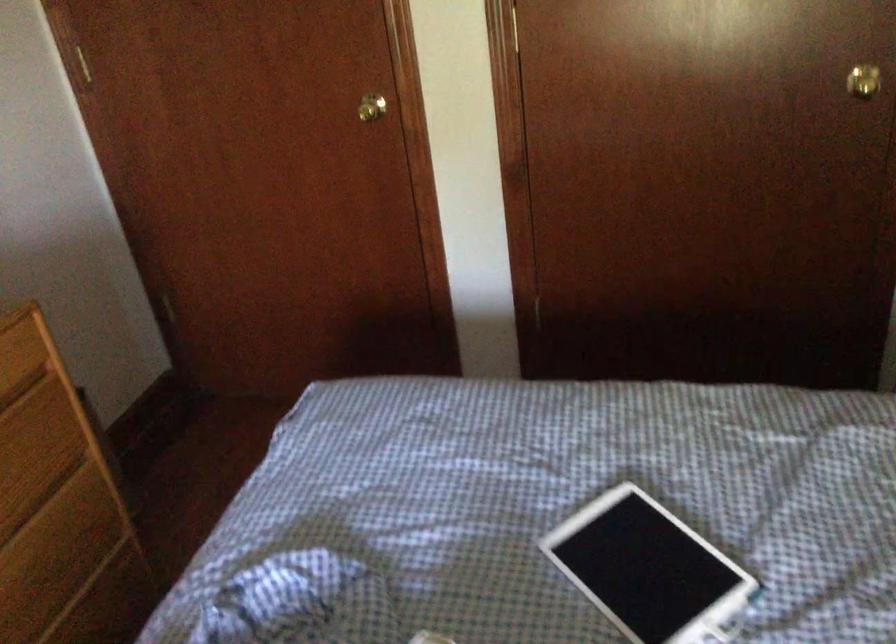
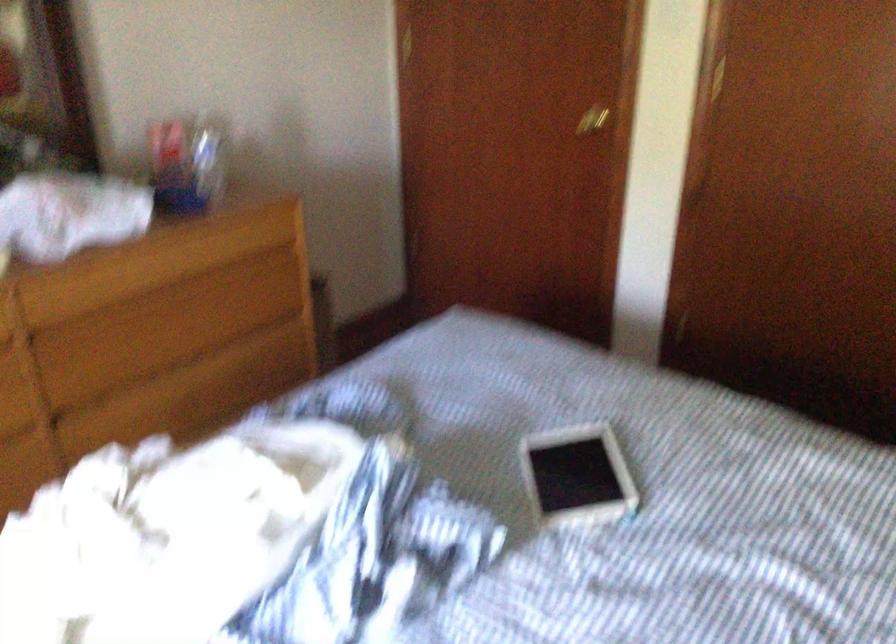
In the second image, find the point that corresponds to point (380, 109) in the first image.

(592, 120)